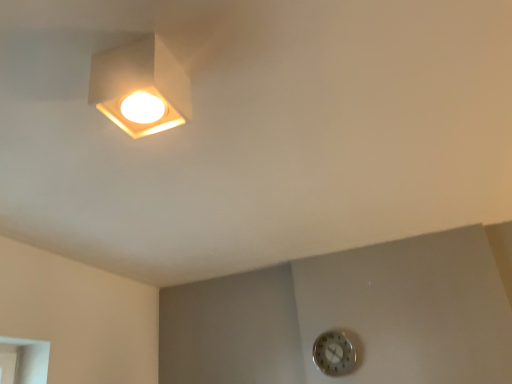
Describe the element at coordinates (141, 87) in the screenshot. I see `matte white square lamp at upper left` at that location.

Where is `matte white square lamp at upper left`? The width and height of the screenshot is (512, 384). matte white square lamp at upper left is located at coordinates (141, 87).

This screenshot has width=512, height=384. What do you see at coordinates (334, 353) in the screenshot?
I see `metallic silver clock at lower right` at bounding box center [334, 353].

Find the location of a particular element. This screenshot has height=384, width=512. metallic silver clock at lower right is located at coordinates (334, 353).

Locate an element on the screen. matte white square lamp at upper left is located at coordinates (141, 87).

Considering the relative positions of matte white square lamp at upper left and metallic silver clock at lower right in the image provided, is matte white square lamp at upper left to the left or to the right of metallic silver clock at lower right?

matte white square lamp at upper left is to the left of metallic silver clock at lower right.

Consider the image. In the image, is matte white square lamp at upper left positioned in front of or behind metallic silver clock at lower right?

Clearly, matte white square lamp at upper left is in front of metallic silver clock at lower right.

Which is behind, point (148, 44) or point (317, 352)?

The point (317, 352) is farther from the camera.

From the image's perspective, which one is positioned lower, matte white square lamp at upper left or metallic silver clock at lower right?

metallic silver clock at lower right is shown below in the image.

From a real-world perspective, between matte white square lamp at upper left and metallic silver clock at lower right, who is vertically higher?

From a 3D spatial view, matte white square lamp at upper left is above.

Which of these two, matte white square lamp at upper left or metallic silver clock at lower right, is wider?

Wider between the two is matte white square lamp at upper left.

Considering the sizes of matte white square lamp at upper left and metallic silver clock at lower right in the image, is matte white square lamp at upper left taller or shorter than metallic silver clock at lower right?

In the image, matte white square lamp at upper left appears to be shorter than metallic silver clock at lower right.

Considering the sizes of matte white square lamp at upper left and metallic silver clock at lower right in the image, is matte white square lamp at upper left bigger or smaller than metallic silver clock at lower right?

Considering their sizes, matte white square lamp at upper left takes up more space than metallic silver clock at lower right.

Is matte white square lamp at upper left completely or partially outside of metallic silver clock at lower right?

Absolutely, matte white square lamp at upper left is external to metallic silver clock at lower right.

Is matte white square lamp at upper left far from metallic silver clock at lower right?

Indeed, matte white square lamp at upper left is not near metallic silver clock at lower right.

Is matte white square lamp at upper left facing towards metallic silver clock at lower right?

No, matte white square lamp at upper left does not turn towards metallic silver clock at lower right.

How much distance is there between matte white square lamp at upper left and metallic silver clock at lower right?

A distance of 1.94 meters exists between matte white square lamp at upper left and metallic silver clock at lower right.

I want to click on lamp above the metallic silver clock at lower right (from the image's perspective), so click(x=141, y=87).

Considering the positions of objects metallic silver clock at lower right and matte white square lamp at upper left in the image provided, who is more to the right, metallic silver clock at lower right or matte white square lamp at upper left?

metallic silver clock at lower right is more to the right.

Which is behind, metallic silver clock at lower right or matte white square lamp at upper left?

metallic silver clock at lower right is further away from the camera.

Is point (317, 359) positioned after point (179, 102)?

Yes.

From the image's perspective, is metallic silver clock at lower right located above or below matte white square lamp at upper left?

Based on their image positions, metallic silver clock at lower right is located beneath matte white square lamp at upper left.

From a real-world perspective, between metallic silver clock at lower right and matte white square lamp at upper left, who is vertically lower?

metallic silver clock at lower right.

Can you confirm if metallic silver clock at lower right is wider than matte white square lamp at upper left?

No.

Consider the image. Does metallic silver clock at lower right have a greater height compared to matte white square lamp at upper left?

Yes, metallic silver clock at lower right is taller than matte white square lamp at upper left.

Does metallic silver clock at lower right have a larger size compared to matte white square lamp at upper left?

No.

Can we say metallic silver clock at lower right lies outside matte white square lamp at upper left?

Yes, metallic silver clock at lower right is outside of matte white square lamp at upper left.

Is metallic silver clock at lower right next to matte white square lamp at upper left and touching it?

metallic silver clock at lower right is not next to matte white square lamp at upper left, and they're not touching.

Is matte white square lamp at upper left at the back of metallic silver clock at lower right?

No, metallic silver clock at lower right is not facing away from matte white square lamp at upper left.

How many degrees apart are the facing directions of metallic silver clock at lower right and matte white square lamp at upper left?

0.574 degrees.

This screenshot has height=384, width=512. In order to click on clock that is on the right side of matte white square lamp at upper left in this screenshot , I will do `click(334, 353)`.

Locate an element on the screen. This screenshot has width=512, height=384. lamp that is above the metallic silver clock at lower right (from the image's perspective) is located at coordinates (x=141, y=87).

I want to click on lamp above the metallic silver clock at lower right (from a real-world perspective), so click(x=141, y=87).